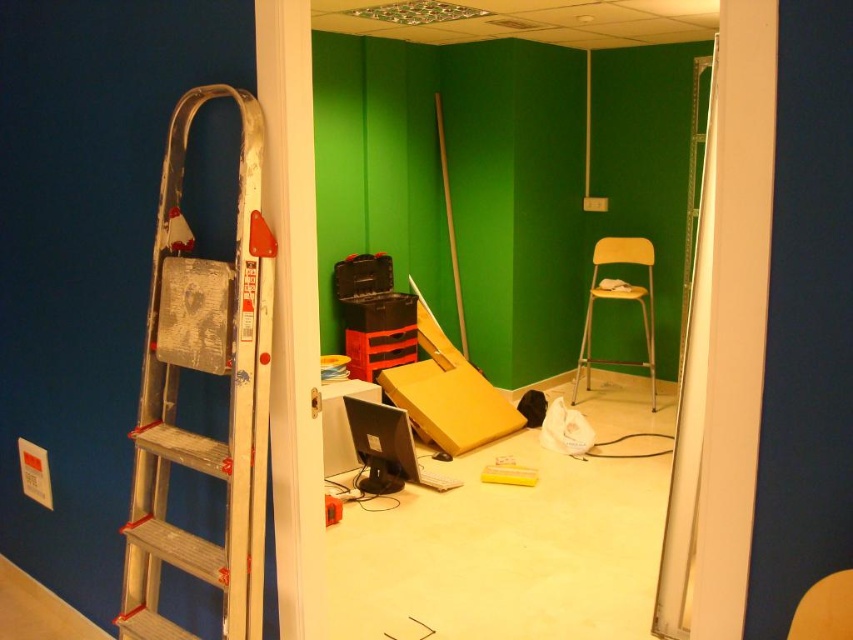
Question: Which object is the farthest from the matte orange chair at center?

Choices:
 (A) silver metallic ladder at left
 (B) matte black monitor at center
 (C) yellow plastic chair at center

Answer: (C)

Question: Estimate the real-world distances between objects in this image. Which object is farther from the silver metallic ladder at left?

Choices:
 (A) matte orange chair at center
 (B) matte black monitor at center

Answer: (B)

Question: Is silver metallic ladder at left below matte orange chair at center?

Choices:
 (A) yes
 (B) no

Answer: (B)

Question: Estimate the real-world distances between objects in this image. Which object is farther from the silver metallic ladder at left?

Choices:
 (A) matte orange chair at center
 (B) matte black monitor at center
 (C) yellow plastic chair at center

Answer: (C)

Question: Does yellow plastic chair at center appear under matte orange chair at center?

Choices:
 (A) yes
 (B) no

Answer: (B)

Question: Does silver metallic ladder at left appear over matte black monitor at center?

Choices:
 (A) yes
 (B) no

Answer: (A)